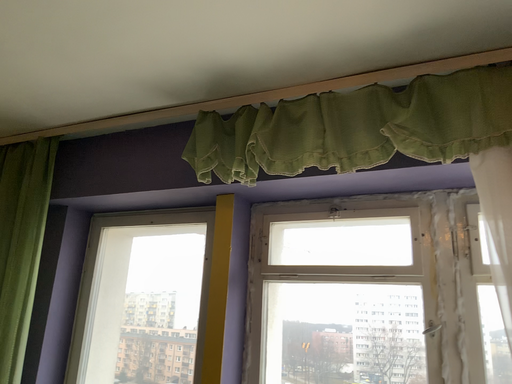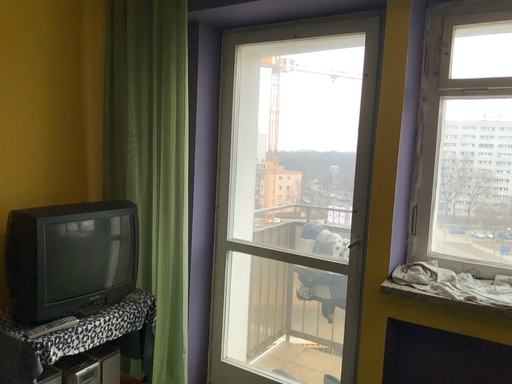
Question: How did the camera likely rotate when shooting the video?

Choices:
 (A) rotated left
 (B) rotated right

Answer: (A)